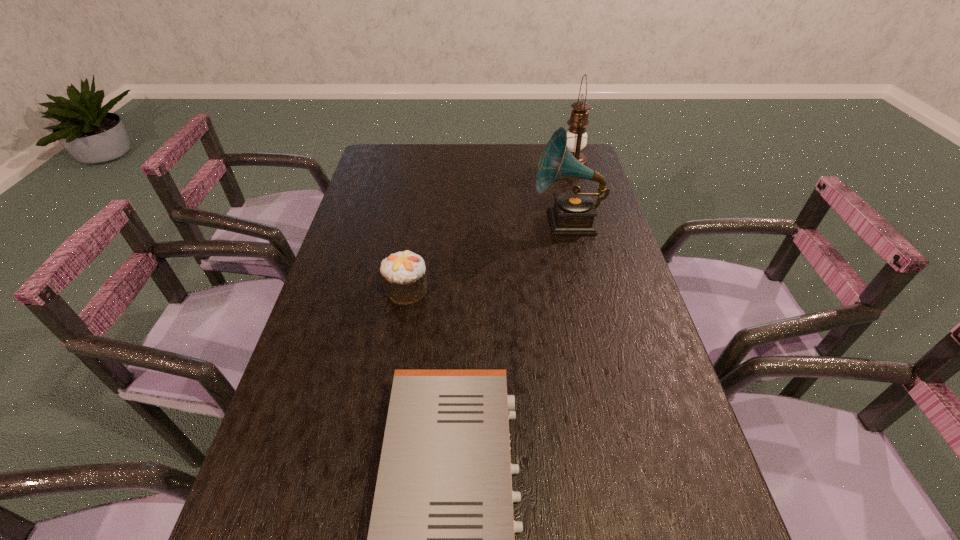
Where is `the farthest object`? The image size is (960, 540). the farthest object is located at coordinates (576, 134).

Image resolution: width=960 pixels, height=540 pixels. Find the location of `the second farthest object`. the second farthest object is located at coordinates (573, 213).

Identify the location of the second nearest object. This screenshot has height=540, width=960. (404, 273).

This screenshot has height=540, width=960. Identify the location of cupcake. (404, 273).

Locate an element on the screen. free point located 0.280m on the front of the farthest object is located at coordinates (588, 223).

Where is `vacant space located from the horn of the phonograph_record`? This screenshot has height=540, width=960. vacant space located from the horn of the phonograph_record is located at coordinates (424, 222).

Image resolution: width=960 pixels, height=540 pixels. What are the coordinates of `free region located 0.300m from the horn of the phonograph_record` in the screenshot? It's located at (437, 222).

The width and height of the screenshot is (960, 540). Find the location of `free space located from the horn of the phonograph_record`. free space located from the horn of the phonograph_record is located at coordinates (466, 222).

At what (x,y) coordinates should I click in order to perform the action: click on vacant region located 0.170m on the front of the cupcake. Please return your answer as a coordinate pair (x, y). Looking at the image, I should click on pos(396,361).

Image resolution: width=960 pixels, height=540 pixels. What are the coordinates of `object that is at the far edge` in the screenshot? It's located at (576, 134).